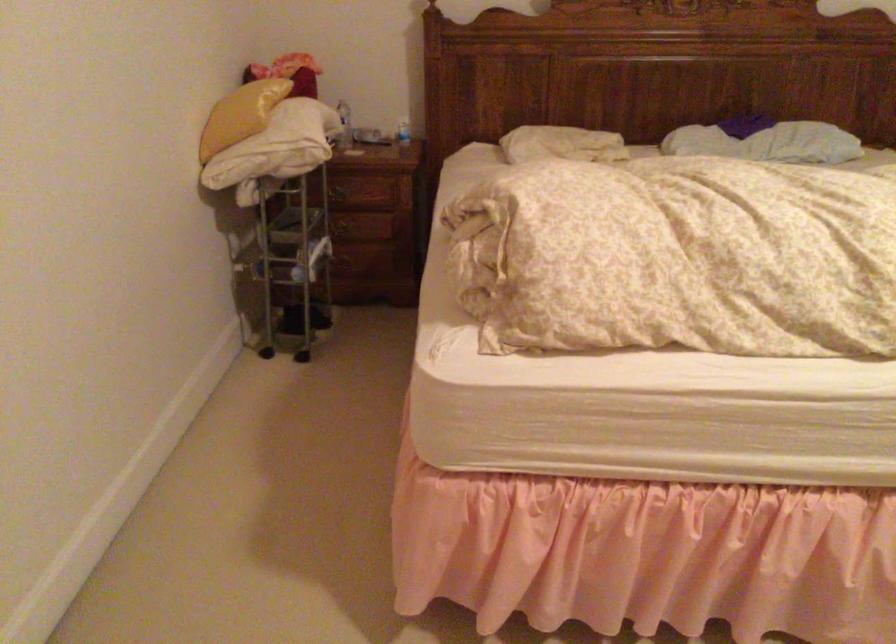
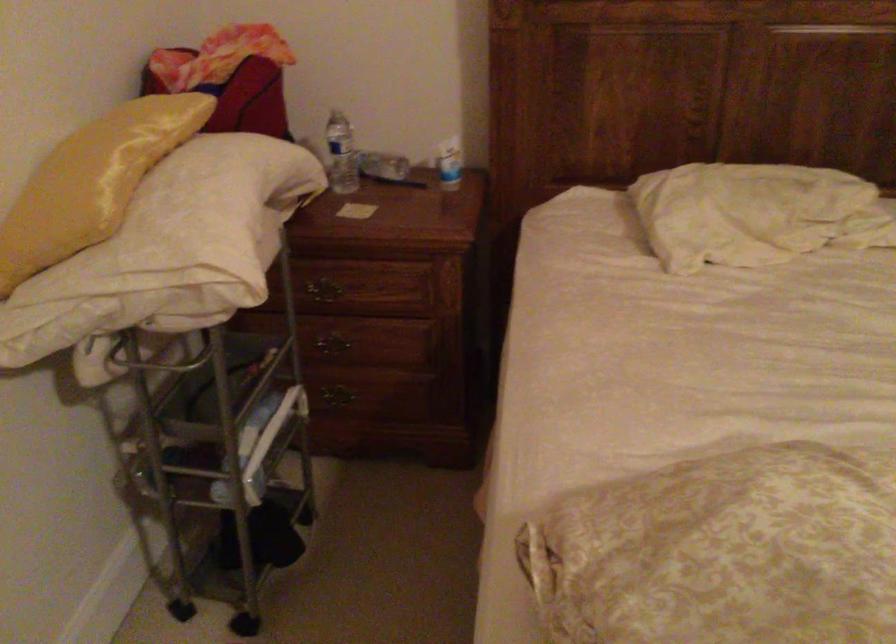
Question: The images are taken continuously from a first-person perspective. In which direction are you moving?

Choices:
 (A) Left
 (B) Right
 (C) Forward
 (D) Backward

Answer: (C)